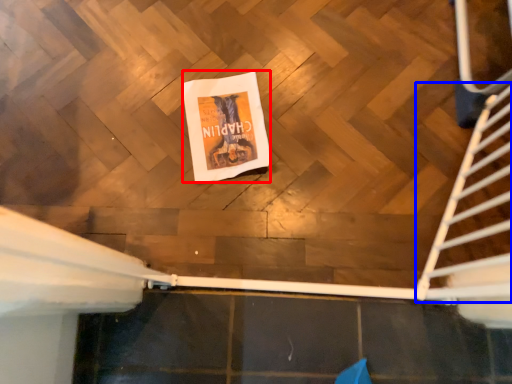
Question: Which object is further to the camera taking this photo, flyer (highlighted by a red box) or stairs (highlighted by a blue box)?

Choices:
 (A) flyer
 (B) stairs

Answer: (A)